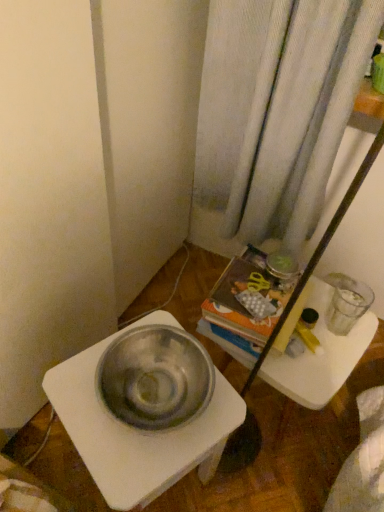
Locate an element on the screen. vacant space situated above translucent plastic tray at center (from a real-world perspective) is located at coordinates (316, 336).